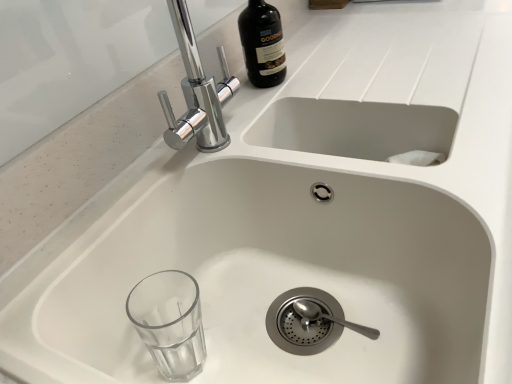
Image resolution: width=512 pixels, height=384 pixels. Identify the location of vacant area that lies to the right of dark brown glass bottle at upper center. (352, 57).